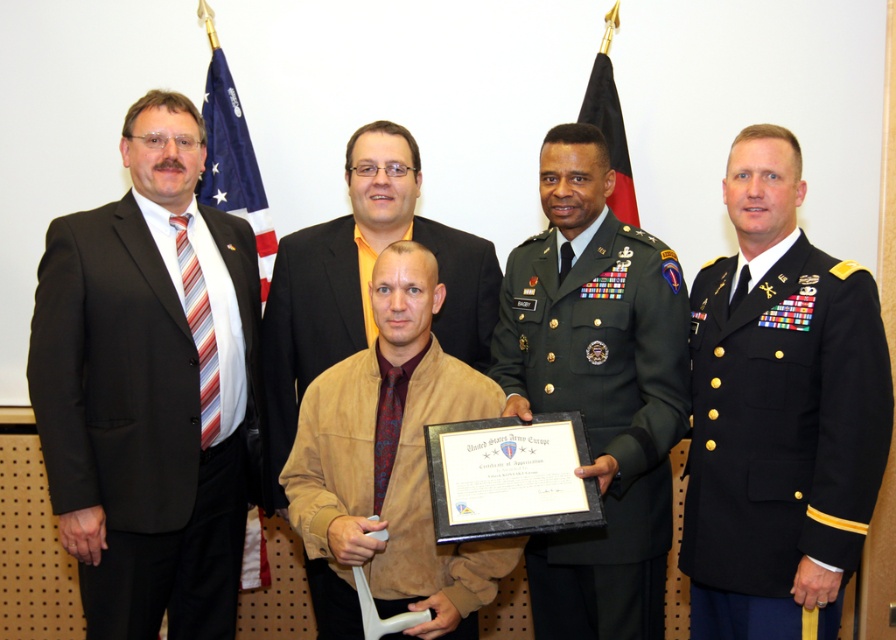
Question: Which object is farther from the camera taking this photo?

Choices:
 (A) brown suede jacket at center
 (B) black wool military uniform at right
 (C) matte black suit at left

Answer: (A)

Question: Which point is farther from the camera taking this photo?

Choices:
 (A) (476, 380)
 (B) (209, 81)

Answer: (B)

Question: Is the position of black wool military uniform at right less distant than that of brown suede jacket at center?

Choices:
 (A) no
 (B) yes

Answer: (B)

Question: Does suede jacket at center have a larger size compared to brown suede jacket at center?

Choices:
 (A) no
 (B) yes

Answer: (A)

Question: Which point is closer to the camera?

Choices:
 (A) brown suede jacket at center
 (B) matte black suit at left

Answer: (B)

Question: Is green military uniform at center above black fabric flag at upper center?

Choices:
 (A) no
 (B) yes

Answer: (A)